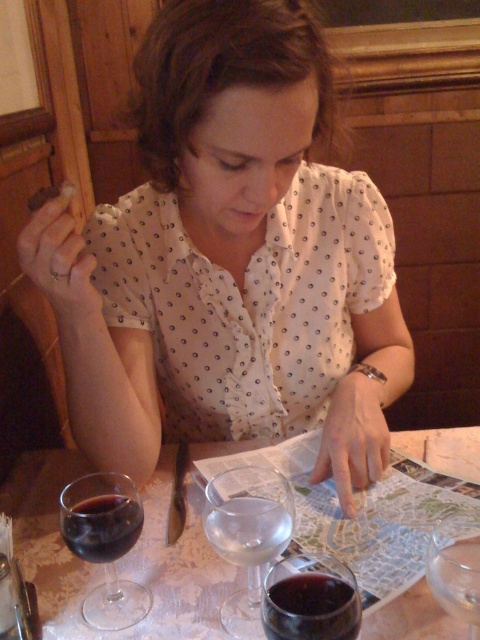
At what (x,y) coordinates should I click in order to perform the action: click on translucent glass wine at center. Please return your answer as a coordinate pair (x, y). The image size is (480, 640). Looking at the image, I should click on (121, 560).

Is translucent glass wine at center above translucent glass wine at lower left?

No.

Who is more forward, (55, 474) or (132, 600)?

Positioned in front is point (132, 600).

Where is `translucent glass wine at center`? translucent glass wine at center is located at coordinates (121, 560).

Between white dotted blouse at center and clear glass wine glass at center, which one appears on the left side from the viewer's perspective?

white dotted blouse at center

Is the position of white dotted blouse at center less distant than that of clear glass wine glass at center?

Yes.

Which is in front, point (251, 236) or point (230, 492)?

Point (230, 492) is in front.

The image size is (480, 640). I want to click on white dotted blouse at center, so click(226, 250).

Locate an element on the screen. clear glass wine glass at center is located at coordinates (248, 536).

Between clear glass wine glass at center and dark red glass at lower center, which one is positioned higher?

clear glass wine glass at center

Between point (242, 602) and point (335, 637), which one is positioned in front?

Point (335, 637) is in front.

The image size is (480, 640). Identify the location of clear glass wine glass at center. (248, 536).